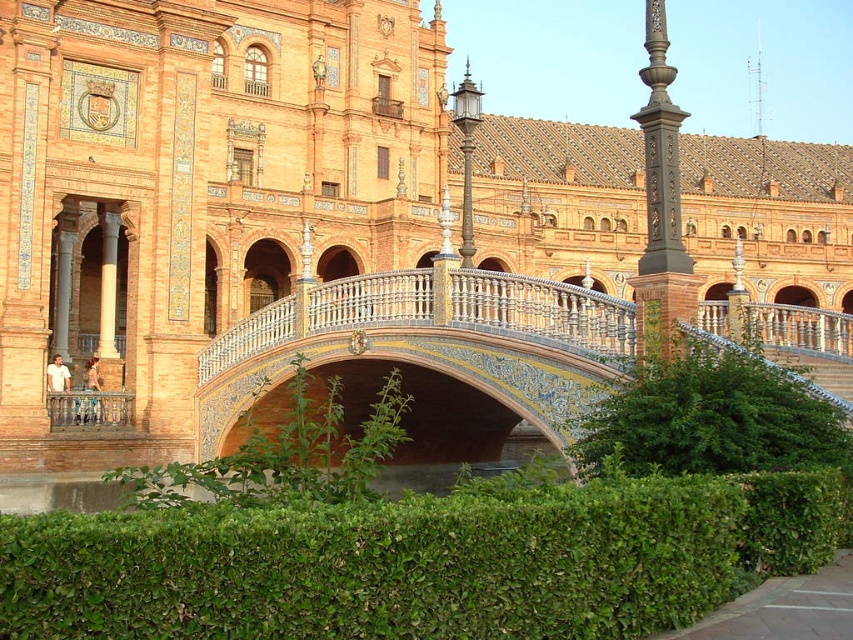
Question: Based on their relative distances, which object is nearer to the dark brown ornate post at center?

Choices:
 (A) decorative ceramic bridge at center
 (B) green leafy hedge at center
 (C) green leafy hedge at lower center

Answer: (C)

Question: Which point is closer to the camera?

Choices:
 (A) green leafy hedge at lower center
 (B) green leafy hedge at center
 (C) dark brown ornate post at center
 (D) decorative ceramic bridge at center

Answer: (B)

Question: Which of the following is the closest to the observer?

Choices:
 (A) (729, 348)
 (B) (222, 460)
 (C) (844, 355)

Answer: (B)

Question: Can you confirm if decorative ceramic bridge at center is bigger than dark brown ornate post at center?

Choices:
 (A) yes
 (B) no

Answer: (B)

Question: Does green leafy hedge at lower center have a lesser width compared to dark brown ornate post at center?

Choices:
 (A) yes
 (B) no

Answer: (A)

Question: Is green leafy hedge at center closer to the viewer compared to dark brown ornate post at center?

Choices:
 (A) no
 (B) yes

Answer: (B)